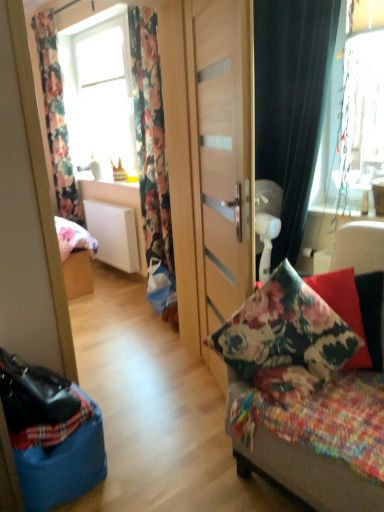
Question: Can we say floral fabric curtain at left, the 2th curtain positioned from the front, lies outside floral fabric cushion at center?

Choices:
 (A) no
 (B) yes

Answer: (B)

Question: Is floral fabric curtain at left, the 2th curtain positioned from the front, shorter than floral fabric cushion at center?

Choices:
 (A) no
 (B) yes

Answer: (A)

Question: Is floral fabric curtain at left, the 2th curtain positioned from the front, oriented towards floral fabric cushion at center?

Choices:
 (A) no
 (B) yes

Answer: (A)

Question: Does floral fabric curtain at left, which is counted as the second curtain, starting from the right, have a greater height compared to floral fabric cushion at center?

Choices:
 (A) no
 (B) yes

Answer: (B)

Question: Does floral fabric curtain at left, the 2th curtain positioned from the front, come behind floral fabric cushion at center?

Choices:
 (A) no
 (B) yes

Answer: (B)

Question: Choose the correct answer: Is floral fabric cushion at center inside fluffy multicolored blanket at right or outside it?

Choices:
 (A) inside
 (B) outside

Answer: (B)

Question: In the image, is floral fabric cushion at center positioned in front of or behind fluffy multicolored blanket at right?

Choices:
 (A) front
 (B) behind

Answer: (A)

Question: In the image, is floral fabric cushion at center on the left side or the right side of fluffy multicolored blanket at right?

Choices:
 (A) left
 (B) right

Answer: (B)

Question: From a real-world perspective, is floral fabric cushion at center physically located above or below fluffy multicolored blanket at right?

Choices:
 (A) below
 (B) above

Answer: (B)

Question: Is transparent glass window at upper right, the first window in the front-to-back sequence, in front of or behind fluffy multicolored blanket at right in the image?

Choices:
 (A) front
 (B) behind

Answer: (B)

Question: From a real-world perspective, relative to fluffy multicolored blanket at right, is transparent glass window at upper right, the first window in the front-to-back sequence, vertically above or below?

Choices:
 (A) below
 (B) above

Answer: (B)

Question: From the image's perspective, relative to fluffy multicolored blanket at right, is transparent glass window at upper right, which ranks as the second window in back-to-front order, above or below?

Choices:
 (A) below
 (B) above

Answer: (B)

Question: Is transparent glass window at upper right, the first window in the front-to-back sequence, situated inside fluffy multicolored blanket at right or outside?

Choices:
 (A) inside
 (B) outside

Answer: (B)

Question: Looking at the image, does floral fabric cushion at center seem bigger or smaller compared to wooden door at center?

Choices:
 (A) small
 (B) big

Answer: (B)

Question: Does point (254, 463) appear closer or farther from the camera than point (208, 140)?

Choices:
 (A) farther
 (B) closer

Answer: (B)